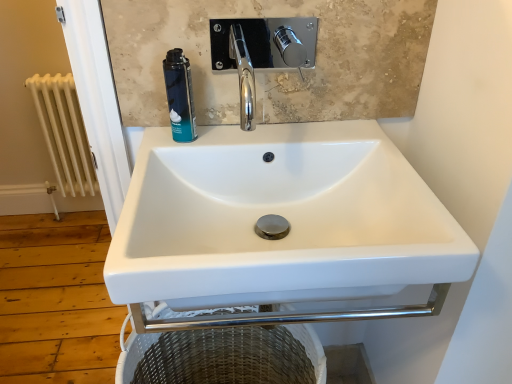
The height and width of the screenshot is (384, 512). Find the location of `vacant area that lies to the right of blue matte shaving cream can at upper left`. vacant area that lies to the right of blue matte shaving cream can at upper left is located at coordinates (251, 140).